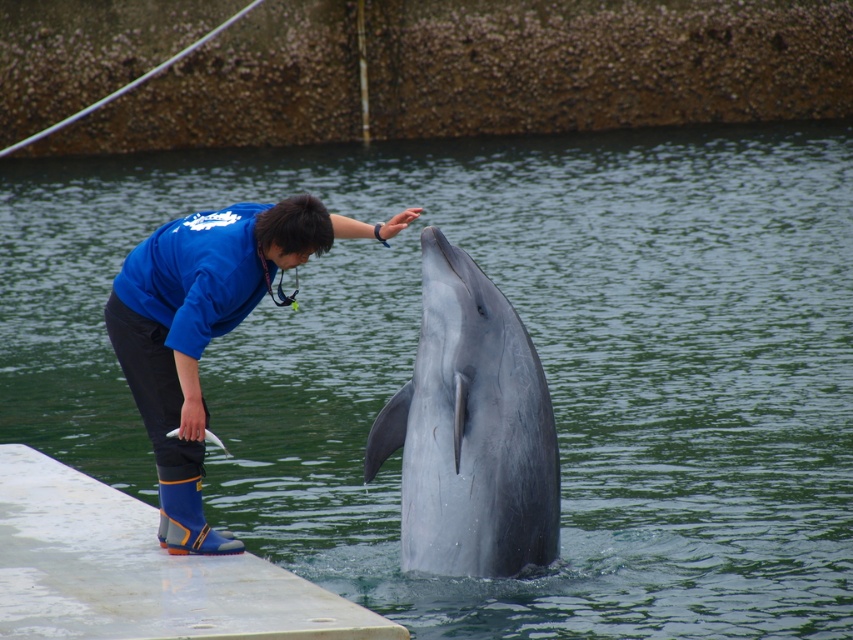
Question: Which of the following is the closest to the observer?

Choices:
 (A) gray smooth dolphin at center
 (B) white concrete dock at lower left
 (C) blue fleece jacket at center

Answer: (A)

Question: Does white concrete dock at lower left have a smaller size compared to blue fleece jacket at center?

Choices:
 (A) yes
 (B) no

Answer: (A)

Question: Which of the following is the farthest from the observer?

Choices:
 (A) (177, 356)
 (B) (32, 467)

Answer: (B)

Question: Which point is closer to the camera taking this photo?

Choices:
 (A) (138, 340)
 (B) (432, 372)

Answer: (B)

Question: Observing the image, what is the correct spatial positioning of white concrete dock at lower left in reference to blue fleece jacket at center?

Choices:
 (A) right
 (B) left

Answer: (B)

Question: Does gray smooth dolphin at center have a larger size compared to blue fleece jacket at center?

Choices:
 (A) no
 (B) yes

Answer: (B)